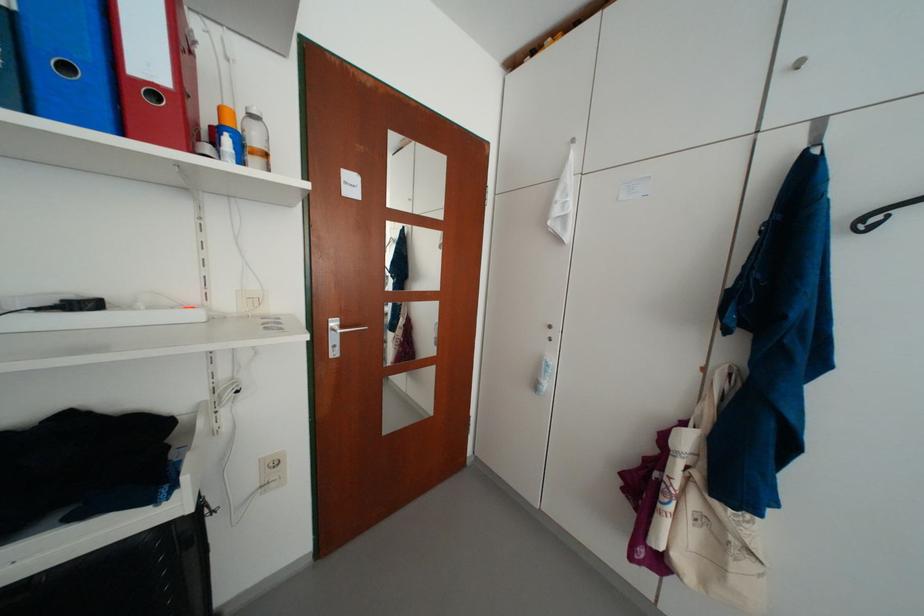
Where would you pull the silver cabinet knob? Please return your answer as a coordinate pair (x, y).

(798, 63)